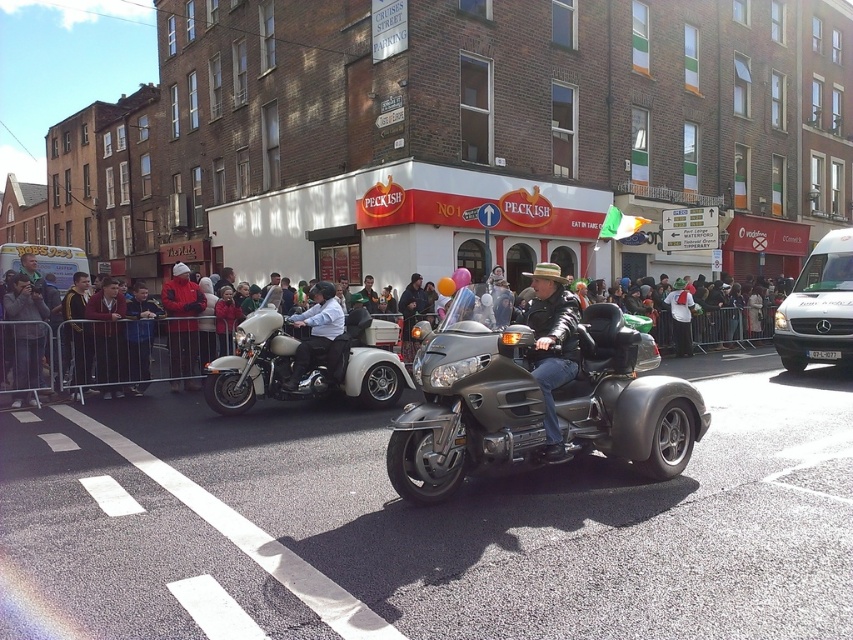
You are a photographer trying to capture both the white matte trike at center and the matte black motorcycle at center in a single frame. Given their sizes, which vehicle will appear bigger in your photo?

The white matte trike at center will appear bigger in the photo since it has a larger size compared to the matte black motorcycle at center.

You are a photographer standing on the street and want to capture both the metallic trike at center and the multicolored fabric crowd at center in a single photo. Based on their positions, which one should you focus on first to ensure both are in frame?

The metallic trike at center is below the multicolored fabric crowd at center, so you should focus on the multicolored fabric crowd at center first to ensure both are in frame.

You are a pedestrian standing on the sidewalk and see both the white matte trike at center and the matte black motorcycle at center. Which vehicle is positioned to the right when facing the street?

The white matte trike at center is positioned to the right of the matte black motorcycle at center when facing the street.